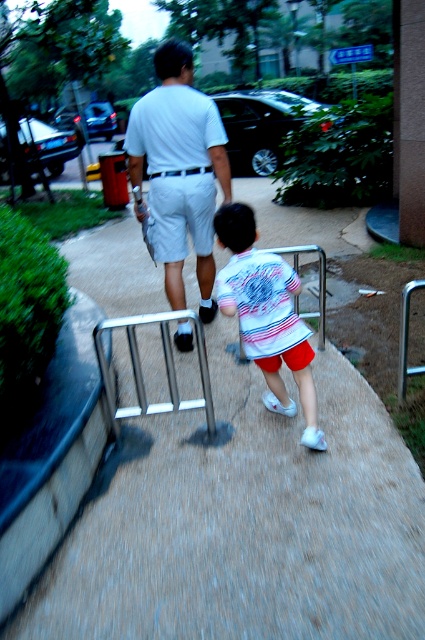
You are standing at point (181,125) and want to walk towards the camera. How far will you have to walk?

You will have to walk 2.90 meters to reach the camera from point (181,125).

You are a delivery robot with a 36 inch wide package. You need to deliver it along the gray concrete pavement at center while avoiding the white cotton shorts at center. Is there enough space between them to move the package?

The distance between the gray concrete pavement at center and the white cotton shorts at center is 35.23 inches. Since the package is 36 inches wide, there isn not enough space to move the package safely.

You are a delivery person with a cart that is 1.8 meters wide. You need to navigate through the pathway between the silver metallic rail at center and the bushes on the other side. Can your cart fit through the space?

The distance between the silver metallic rail at center and the viewer is 2.13 meters. Since the cart is 1.8 meters wide, it can fit through the space as it is wider than the cart.